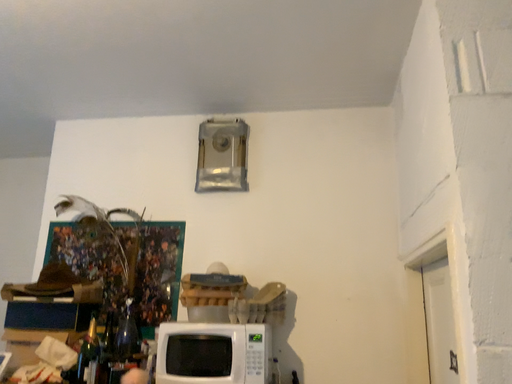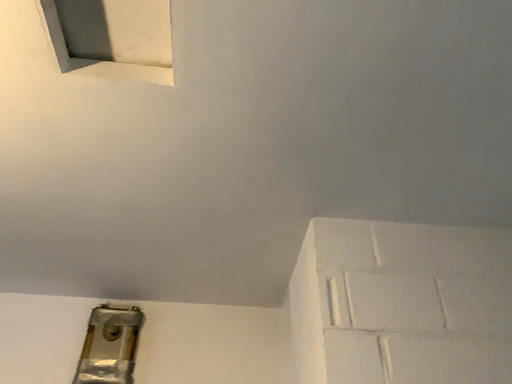
Question: Which way did the camera rotate in the video?

Choices:
 (A) rotated downward
 (B) rotated upward

Answer: (B)